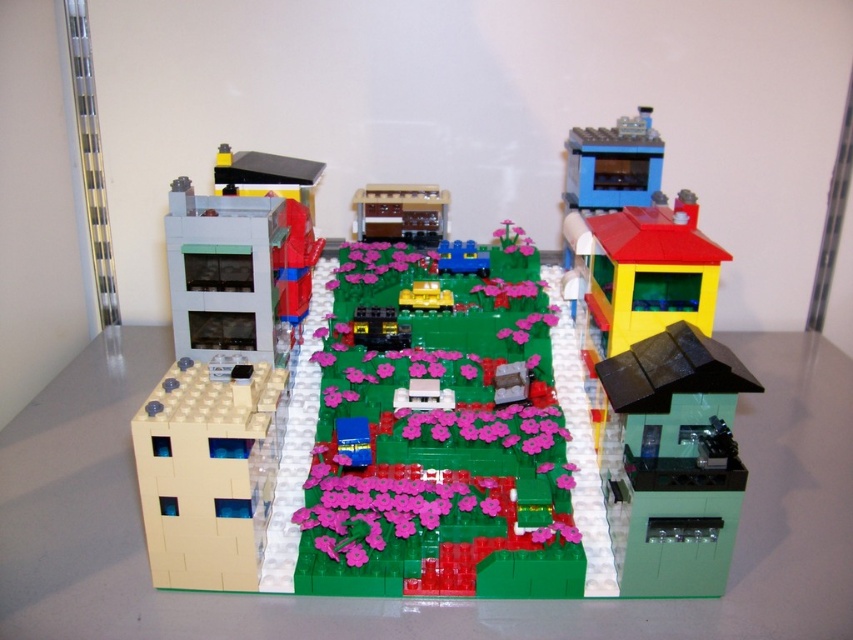
Question: Among these points, which one is farthest from the camera?

Choices:
 (A) click(604, 371)
 (B) click(250, 577)
 (C) click(397, 256)
 (D) click(416, 237)

Answer: (D)

Question: Considering the real-world distances, which object is closest to the smooth plastic house at upper left?

Choices:
 (A) yellow plastic car at center
 (B) blue plastic train at center
 (C) pink matte flower at center
 (D) green matte flower bed at center

Answer: (C)

Question: Can you confirm if beige matte building at lower left is positioned above smooth plastic house at upper left?

Choices:
 (A) yes
 (B) no

Answer: (B)

Question: Does translucent yellow building at center lie in front of blue plastic train at center?

Choices:
 (A) no
 (B) yes

Answer: (B)

Question: Is matte brown building at center further to the viewer compared to blue plastic train at center?

Choices:
 (A) yes
 (B) no

Answer: (A)

Question: Which point is farther to the camera?

Choices:
 (A) (401, 256)
 (B) (370, 513)
 (C) (192, 580)
 (D) (724, 499)

Answer: (A)